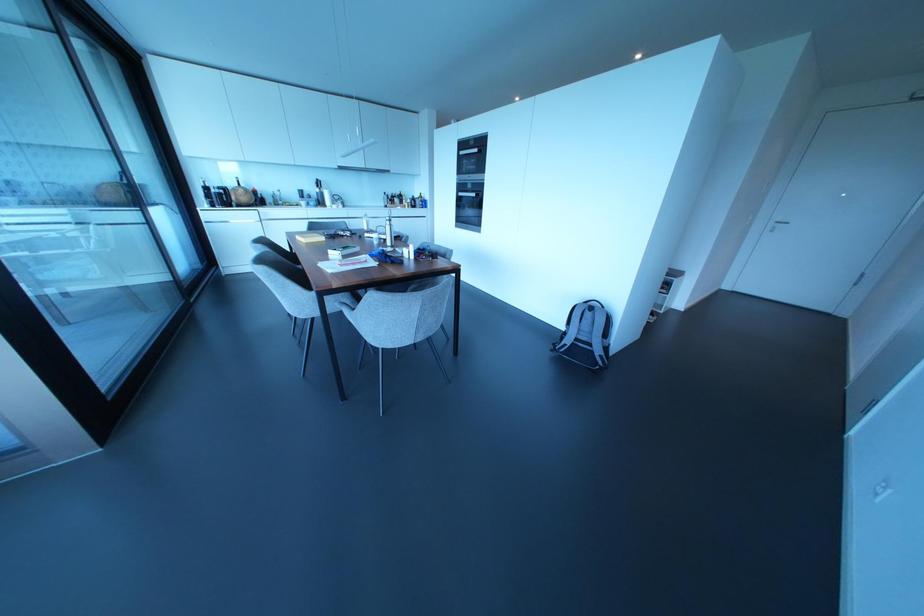
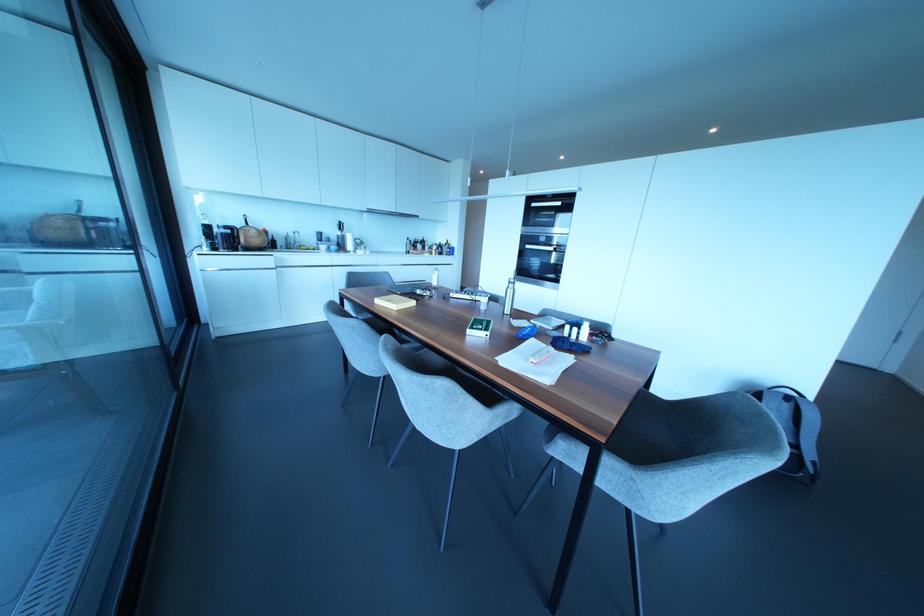
In the second image, find the point that corresponds to the point at 590,308 in the first image.

(787, 397)